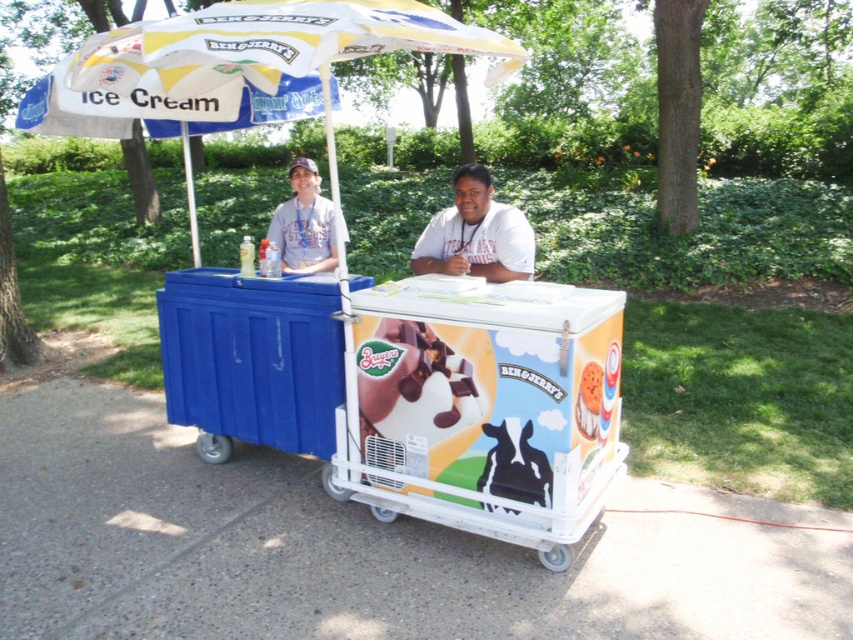
Question: Is white fabric umbrella at upper left thinner than white matte shirt at center?

Choices:
 (A) yes
 (B) no

Answer: (A)

Question: Which object is the farthest from the yellow fabric umbrella at upper center?

Choices:
 (A) blue plastic cooler at center
 (B) white fabric umbrella at upper left

Answer: (A)

Question: Among these points, which one is nearest to the camera?

Choices:
 (A) (289, 259)
 (B) (459, 260)
 (C) (115, 81)

Answer: (C)

Question: Is yellow fabric umbrella at upper center bigger than light blue shirt at center?

Choices:
 (A) no
 (B) yes

Answer: (A)

Question: Does white fabric umbrella at upper left come behind white matte shirt at center?

Choices:
 (A) yes
 (B) no

Answer: (A)

Question: Among these objects, which one is farthest from the camera?

Choices:
 (A) white fabric umbrella at upper left
 (B) blue plastic cooler at center

Answer: (A)